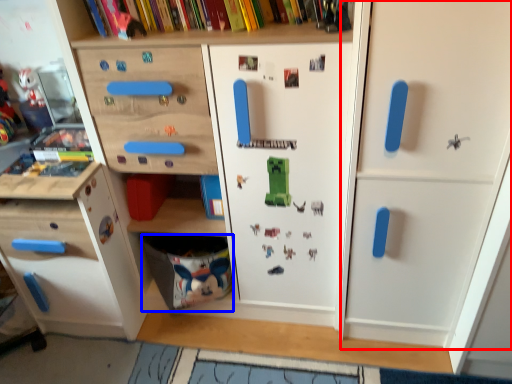
Question: Which point is closer to the camera, door (highlighted by a red box) or drawer (highlighted by a blue box)?

Choices:
 (A) door
 (B) drawer

Answer: (A)